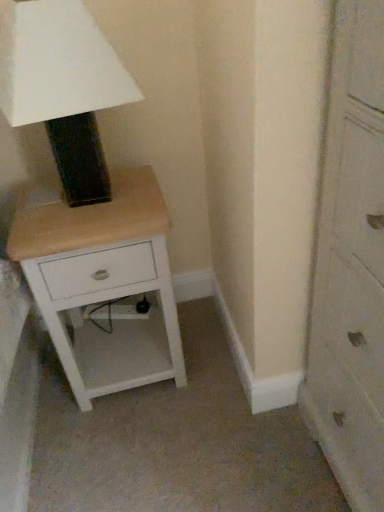
Question: Is white wood nightstand at lower left facing towards wooden chest of drawers at right?

Choices:
 (A) no
 (B) yes

Answer: (A)

Question: From a real-world perspective, is white wood nightstand at lower left located higher than wooden chest of drawers at right?

Choices:
 (A) yes
 (B) no

Answer: (B)

Question: Considering the relative sizes of white wood nightstand at lower left and wooden chest of drawers at right in the image provided, is white wood nightstand at lower left thinner than wooden chest of drawers at right?

Choices:
 (A) yes
 (B) no

Answer: (B)

Question: From the image's perspective, would you say white wood nightstand at lower left is shown under wooden chest of drawers at right?

Choices:
 (A) yes
 (B) no

Answer: (B)

Question: Considering the relative sizes of white wood nightstand at lower left and wooden chest of drawers at right in the image provided, is white wood nightstand at lower left shorter than wooden chest of drawers at right?

Choices:
 (A) no
 (B) yes

Answer: (B)

Question: Is matte black lampshade at upper left wider or thinner than white wood nightstand at lower left?

Choices:
 (A) wide
 (B) thin

Answer: (B)

Question: Choose the correct answer: Is matte black lampshade at upper left inside white wood nightstand at lower left or outside it?

Choices:
 (A) outside
 (B) inside

Answer: (A)

Question: Is matte black lampshade at upper left in front of or behind white wood nightstand at lower left in the image?

Choices:
 (A) behind
 (B) front

Answer: (B)

Question: From a real-world perspective, relative to white wood nightstand at lower left, is matte black lampshade at upper left vertically above or below?

Choices:
 (A) above
 (B) below

Answer: (A)

Question: In the image, is wooden chest of drawers at right on the left side or the right side of white wood nightstand at lower left?

Choices:
 (A) left
 (B) right

Answer: (B)

Question: From a real-world perspective, is wooden chest of drawers at right positioned above or below white wood nightstand at lower left?

Choices:
 (A) above
 (B) below

Answer: (A)

Question: Is wooden chest of drawers at right bigger or smaller than white wood nightstand at lower left?

Choices:
 (A) big
 (B) small

Answer: (A)

Question: From the image's perspective, is wooden chest of drawers at right positioned above or below white wood nightstand at lower left?

Choices:
 (A) below
 (B) above

Answer: (A)

Question: From a real-world perspective, relative to matte black lampshade at upper left, is wooden chest of drawers at right vertically above or below?

Choices:
 (A) above
 (B) below

Answer: (B)

Question: Is wooden chest of drawers at right to the left or to the right of matte black lampshade at upper left in the image?

Choices:
 (A) right
 (B) left

Answer: (A)